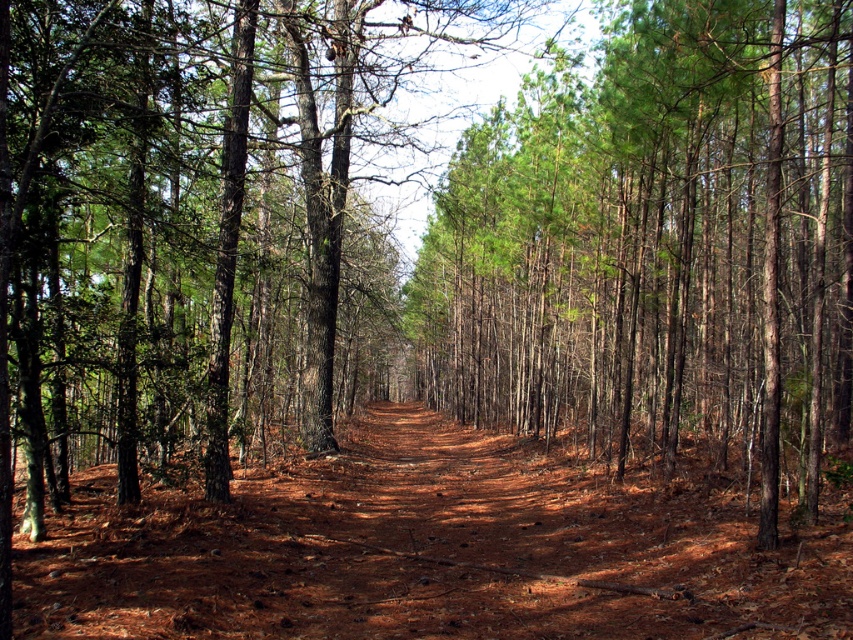
You are a hiker trying to follow the brown dirt track at center through the forest. As you walk, you notice a green smooth tree at center. On which side of the track will you find this tree?

The green smooth tree at center is located to the right of the brown dirt track at center.

You are a hiker trying to determine the best path through the forest. You see a green smooth tree at center and a brown dirt track at center. Which one is narrower?

The green smooth tree at center is narrower than the brown dirt track at center.

You are a hiker who wants to take a photo of the green smooth tree at center and the brown dirt track at center. Since you want both objects to be in focus, you need to know their heights. Which object is taller?

The green smooth tree at center is taller than the brown dirt track at center, so you should adjust your camera settings to focus on the taller tree to ensure both are in focus.